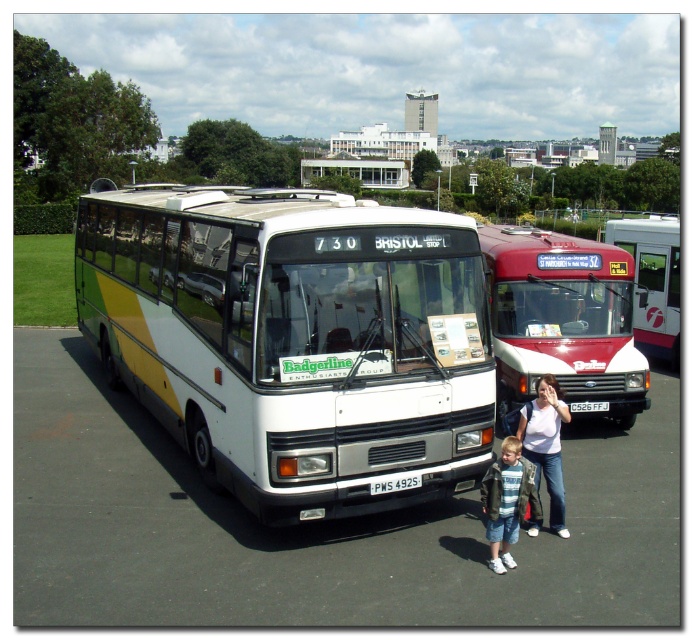
Can you confirm if white/yellow/green striped bus at left is smaller than leather jacket at lower right?

No, white/yellow/green striped bus at left is not smaller than leather jacket at lower right.

Who is more distant from viewer, (x=119, y=296) or (x=502, y=520)?

The point (x=119, y=296) is behind.

The width and height of the screenshot is (694, 640). Identify the location of white/yellow/green striped bus at left. (294, 339).

Does white/yellow/green striped bus at left have a larger size compared to red metallic bus at center?

Correct, white/yellow/green striped bus at left is larger in size than red metallic bus at center.

Describe the element at coordinates (294, 339) in the screenshot. The height and width of the screenshot is (640, 694). I see `white/yellow/green striped bus at left` at that location.

The width and height of the screenshot is (694, 640). I want to click on white/yellow/green striped bus at left, so click(x=294, y=339).

Between white/yellow/green striped bus at left and maroon matte bus at center, which one has less height?

maroon matte bus at center is shorter.

The height and width of the screenshot is (640, 694). What do you see at coordinates (294, 339) in the screenshot? I see `white/yellow/green striped bus at left` at bounding box center [294, 339].

The width and height of the screenshot is (694, 640). In order to click on white/yellow/green striped bus at left in this screenshot , I will do `click(294, 339)`.